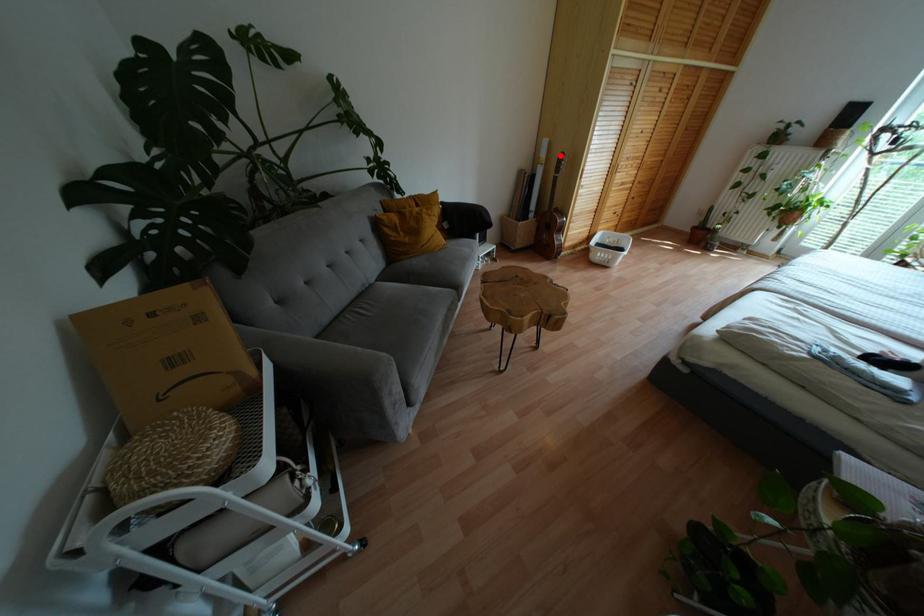
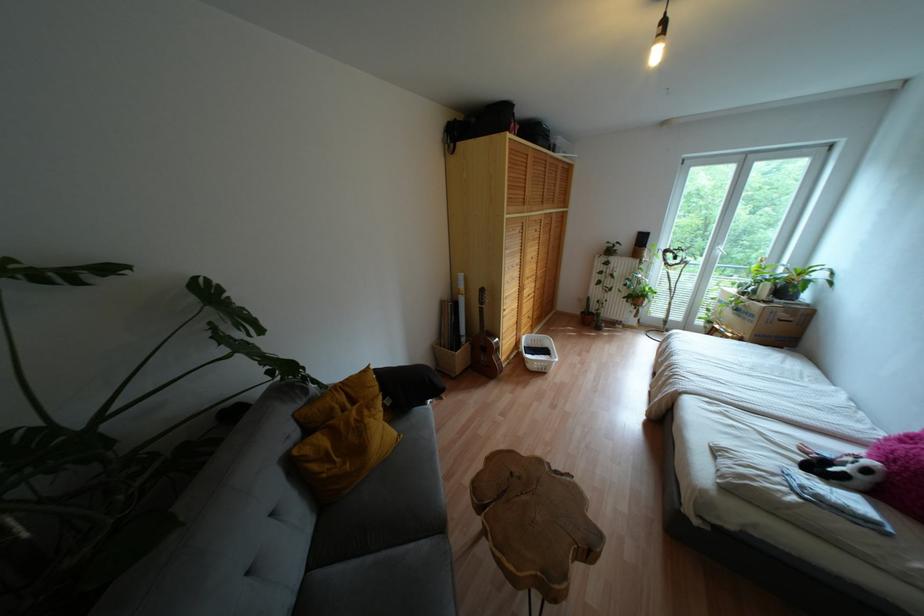
Where in the second image is the point corresponding to the highlighted location from the first image?

(481, 290)